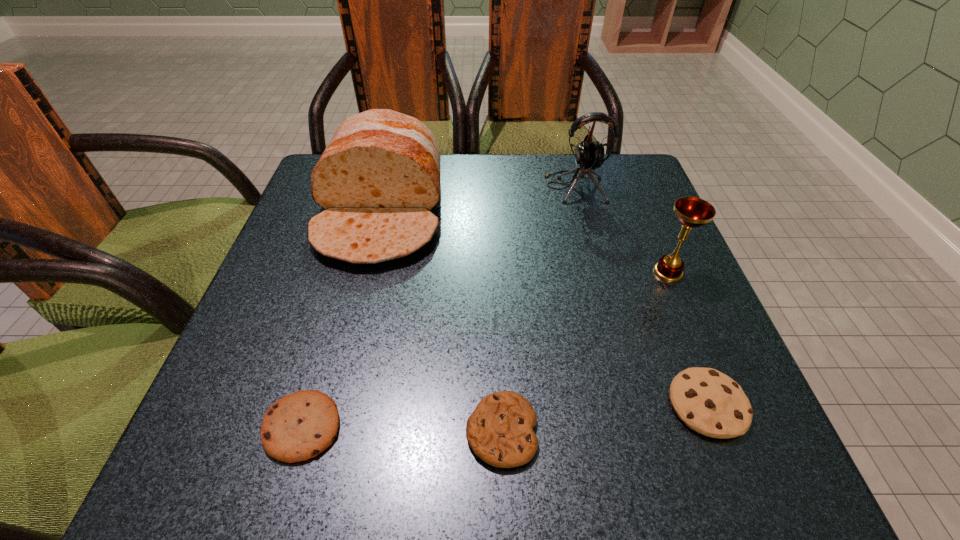
This screenshot has width=960, height=540. In order to click on vacant space at the near right corner of the desktop in this screenshot , I will do `click(707, 450)`.

What are the coordinates of `vacant space in between the leftmost cookie and the earphone` in the screenshot? It's located at (x=439, y=307).

Where is `free space between the chalice and the earphone`? The image size is (960, 540). free space between the chalice and the earphone is located at coordinates (622, 230).

The width and height of the screenshot is (960, 540). In order to click on free space between the leftmost cookie and the bread in this screenshot , I will do `click(342, 320)`.

What are the coordinates of `empty space that is in between the bread and the fourth tallest object` in the screenshot? It's located at (544, 308).

Identify the location of vacant space that is in between the earphone and the tallest cookie. (641, 296).

Locate an element on the screen. The image size is (960, 540). unoccupied position between the earphone and the bread is located at coordinates (478, 200).

You are a GUI agent. You are given a task and a screenshot of the screen. Output one action in this format:
    pyautogui.click(x=<x>, y=<y>)
    Task: Click on the vacant point located between the earphone and the third object from left to right
    
    Given the screenshot: What is the action you would take?
    pyautogui.click(x=539, y=309)

Find the location of a particular element. This screenshot has height=540, width=960. vacant space in between the chalice and the earphone is located at coordinates 622,230.

You are a GUI agent. You are given a task and a screenshot of the screen. Output one action in this format:
    pyautogui.click(x=<x>, y=<y>)
    Task: Click on the vacant space that is in between the bread and the tallest cookie
    
    Given the screenshot: What is the action you would take?
    [x=544, y=308]